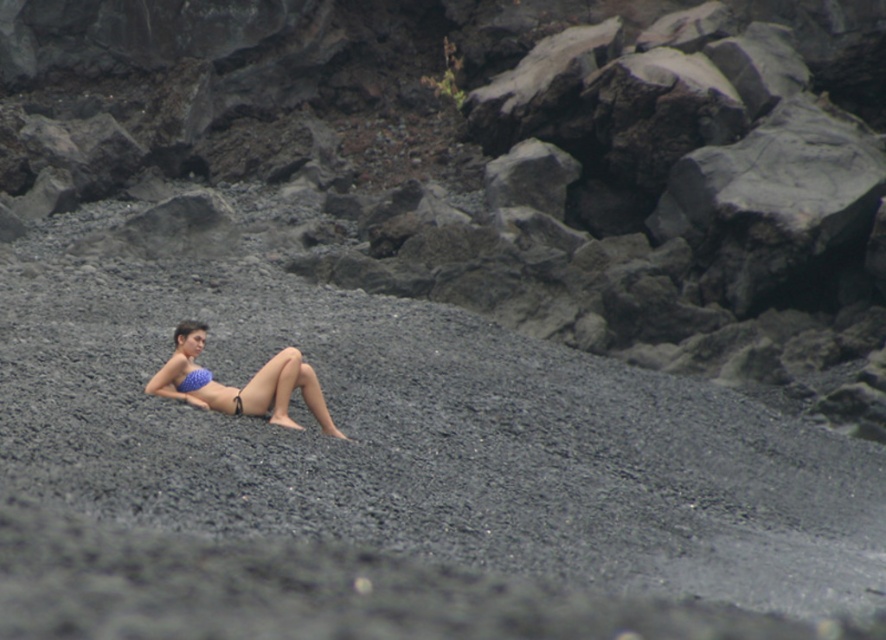
Question: Does smooth gray rock at center have a lesser width compared to blue matte bikini top at center?

Choices:
 (A) no
 (B) yes

Answer: (A)

Question: Which point is farther from the camera taking this photo?

Choices:
 (A) (0, 433)
 (B) (285, 22)

Answer: (B)

Question: In this image, where is gray gravel at center located relative to smooth gray rock at center?

Choices:
 (A) left
 (B) right

Answer: (A)

Question: Does gray gravel at center appear on the right side of blue matte bikini top at center?

Choices:
 (A) no
 (B) yes

Answer: (B)

Question: Which point appears closest to the camera in this image?

Choices:
 (A) (181, 384)
 (B) (550, 273)
 (C) (39, 525)

Answer: (C)

Question: Among these objects, which one is nearest to the camera?

Choices:
 (A) blue bikini top at center
 (B) blue matte bikini top at center
 (C) smooth gray rock at center

Answer: (A)